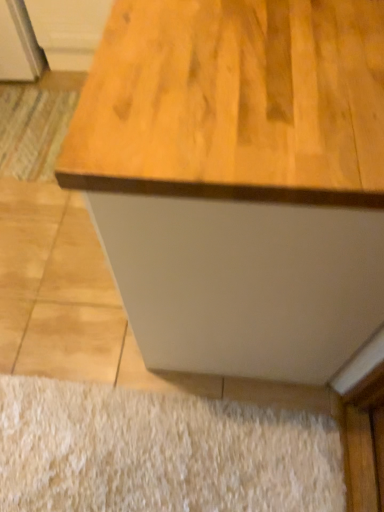
Question: Is wooden cabinet at upper left not inside white shaggy rug at lower center, which is the 2th doormat in top-to-bottom order?

Choices:
 (A) yes
 (B) no

Answer: (A)

Question: Is wooden cabinet at upper left facing towards white shaggy rug at lower center, acting as the first doormat starting from the right?

Choices:
 (A) no
 (B) yes

Answer: (B)

Question: From the image's perspective, would you say wooden cabinet at upper left is positioned over white shaggy rug at lower center, acting as the first doormat starting from the right?

Choices:
 (A) yes
 (B) no

Answer: (A)

Question: Considering the relative positions of wooden cabinet at upper left and white shaggy rug at lower center, which is the 2th doormat in top-to-bottom order, in the image provided, is wooden cabinet at upper left to the left of white shaggy rug at lower center, which is the 2th doormat in top-to-bottom order, from the viewer's perspective?

Choices:
 (A) no
 (B) yes

Answer: (B)

Question: Is wooden cabinet at upper left taller than white shaggy rug at lower center, which is the second doormat from back to front?

Choices:
 (A) yes
 (B) no

Answer: (A)

Question: Looking at the image, does white shaggy rug at lower center, which is the 2th doormat in top-to-bottom order, seem bigger or smaller compared to wooden cabinet at upper left?

Choices:
 (A) big
 (B) small

Answer: (B)

Question: Is point (34, 429) closer or farther from the camera than point (54, 11)?

Choices:
 (A) closer
 (B) farther

Answer: (A)

Question: Considering their positions, is white shaggy rug at lower center, arranged as the 1th doormat when ordered from the bottom, located in front of or behind wooden cabinet at upper left?

Choices:
 (A) front
 (B) behind

Answer: (A)

Question: Do you think white shaggy rug at lower center, which is the 2th doormat in top-to-bottom order, is within wooden cabinet at upper left, or outside of it?

Choices:
 (A) inside
 (B) outside

Answer: (B)

Question: From a real-world perspective, is striped fabric doormat at lower left, which ranks as the first doormat in left-to-right order, positioned above or below wooden cabinet at upper left?

Choices:
 (A) above
 (B) below

Answer: (B)

Question: Do you think striped fabric doormat at lower left, arranged as the 2th doormat when viewed from the right, is within wooden cabinet at upper left, or outside of it?

Choices:
 (A) outside
 (B) inside

Answer: (A)

Question: In terms of size, does striped fabric doormat at lower left, marked as the 1th doormat in a back-to-front arrangement, appear bigger or smaller than wooden cabinet at upper left?

Choices:
 (A) big
 (B) small

Answer: (B)

Question: Based on their positions, is striped fabric doormat at lower left, marked as the 1th doormat in a back-to-front arrangement, located to the left or right of wooden cabinet at upper left?

Choices:
 (A) right
 (B) left

Answer: (B)

Question: Considering their positions, is white shaggy rug at lower center, arranged as the 1th doormat when ordered from the bottom, located in front of or behind striped fabric doormat at lower left, arranged as the 2th doormat when viewed from the right?

Choices:
 (A) behind
 (B) front

Answer: (B)

Question: From the image's perspective, is white shaggy rug at lower center, acting as the first doormat starting from the right, located above or below striped fabric doormat at lower left, which ranks as the first doormat in left-to-right order?

Choices:
 (A) below
 (B) above

Answer: (A)